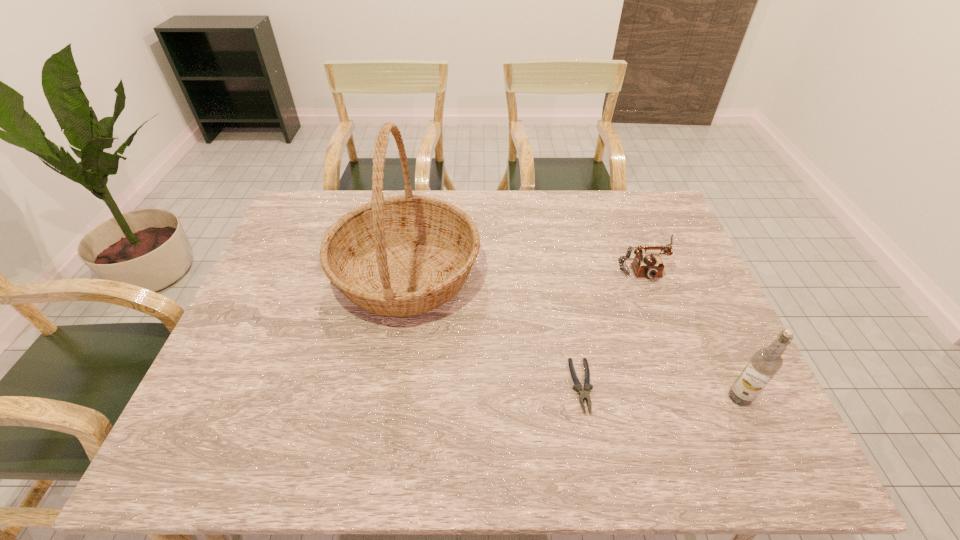
Identify the location of object that ranks as the second closest to the shortest object. (651, 266).

The height and width of the screenshot is (540, 960). Identify the location of object that is the closest to the vodka. (584, 391).